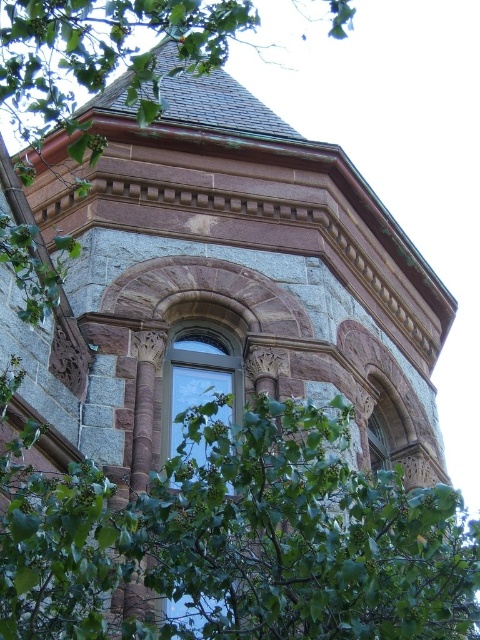
You are standing in front of the historic building and notice a green leafy tree at center and a clear glass window at center. Which object is positioned to the right of the other?

The green leafy tree at center is to the right of the clear glass window at center according to the description.

You are a window installer assessing the space in front of the historic building. You need to determine if the green leafy tree at center will block the clear glass window at center when viewed from the street. Based on their widths, can the window still be seen clearly?

The green leafy tree at center might be wider than clear glass window at center, so there is a possibility that the tree could block the window from view. Further assessment of their exact positions and angles would be needed to confirm visibility.